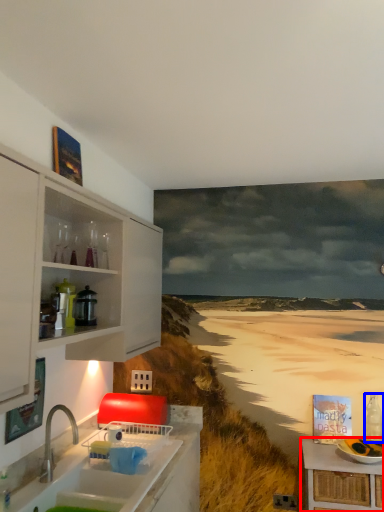
Question: Which of the following is the farthest to the observer, table (highlighted by a red box) or bottle (highlighted by a blue box)?

Choices:
 (A) table
 (B) bottle

Answer: (B)